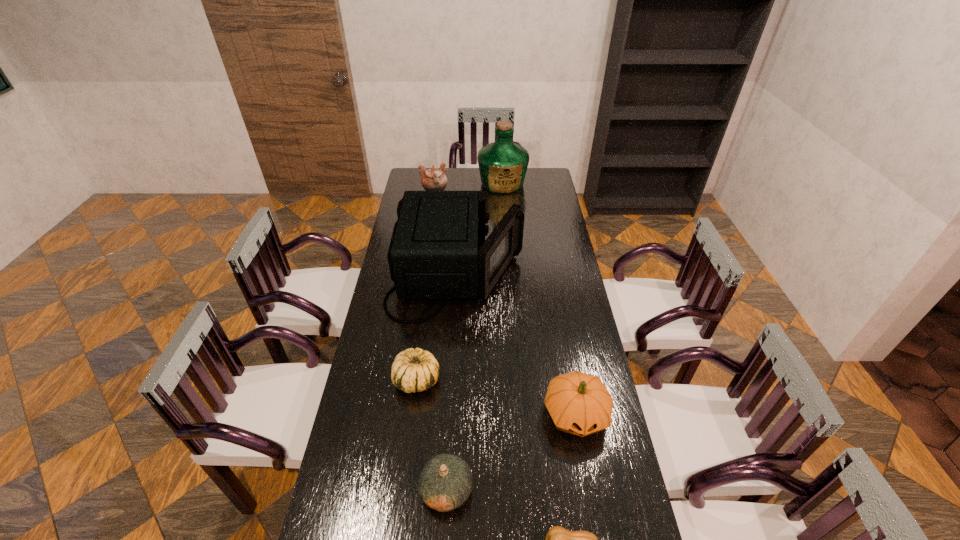
In the image, there is a desktop. Identify the location of vacant space at the right edge. Image resolution: width=960 pixels, height=540 pixels. (x=573, y=265).

Where is `free space that is in between the fourth shortest object and the microwave oven`? This screenshot has height=540, width=960. free space that is in between the fourth shortest object and the microwave oven is located at coordinates (516, 344).

Image resolution: width=960 pixels, height=540 pixels. I want to click on vacant space in between the tallest gourd and the sixth shortest object, so click(516, 344).

Choose which object is the third nearest neighbor to the fourth tallest object. Please provide its 2D coordinates. Your answer should be formatted as a tuple, i.e. [(x, y)], where the tuple contains the x and y coordinates of a point satisfying the conditions above.

[(434, 253)]

Choose which object is the fourth nearest neighbor to the fifth shortest object. Please provide its 2D coordinates. Your answer should be formatted as a tuple, i.e. [(x, y)], where the tuple contains the x and y coordinates of a point satisfying the conditions above.

[(579, 403)]

Locate which gourd ranks in proximity to the tallest gourd. Please provide its 2D coordinates. Your answer should be formatted as a tuple, i.e. [(x, y)], where the tuple contains the x and y coordinates of a point satisfying the conditions above.

[(445, 483)]

Locate an element on the screen. The height and width of the screenshot is (540, 960). gourd that stands as the closest to the shortest object is located at coordinates (445, 483).